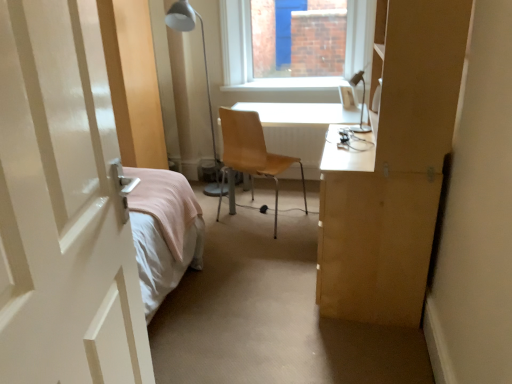
Question: Is there a large distance between metallic silver table lamp at upper right, which is the second table lamp in left-to-right order, and light brown wood chair at center?

Choices:
 (A) no
 (B) yes

Answer: (A)

Question: Is metallic silver table lamp at upper right, which is the second table lamp in left-to-right order, positioned with its back to light brown wood chair at center?

Choices:
 (A) no
 (B) yes

Answer: (A)

Question: Is metallic silver table lamp at upper right, which is the second table lamp in left-to-right order, facing towards light brown wood chair at center?

Choices:
 (A) no
 (B) yes

Answer: (A)

Question: Considering the relative sizes of metallic silver table lamp at upper right, arranged as the first table lamp when viewed from the front, and light brown wood chair at center in the image provided, is metallic silver table lamp at upper right, arranged as the first table lamp when viewed from the front, thinner than light brown wood chair at center?

Choices:
 (A) no
 (B) yes

Answer: (B)

Question: Is metallic silver table lamp at upper right, the 2th table lamp viewed from the back, further to the viewer compared to light brown wood chair at center?

Choices:
 (A) yes
 (B) no

Answer: (B)

Question: Considering the relative sizes of metallic silver table lamp at upper right, the 2th table lamp viewed from the back, and light brown wood chair at center in the image provided, is metallic silver table lamp at upper right, the 2th table lamp viewed from the back, shorter than light brown wood chair at center?

Choices:
 (A) no
 (B) yes

Answer: (B)

Question: From the image's perspective, is white glossy desk at center located beneath metallic silver table lamp at upper right, the 2th table lamp viewed from the back?

Choices:
 (A) no
 (B) yes

Answer: (B)

Question: Is white glossy desk at center facing away from metallic silver table lamp at upper right, arranged as the 1th table lamp when viewed from the right?

Choices:
 (A) yes
 (B) no

Answer: (B)

Question: Can you confirm if white glossy desk at center is shorter than metallic silver table lamp at upper right, arranged as the first table lamp when viewed from the front?

Choices:
 (A) no
 (B) yes

Answer: (A)

Question: From a real-world perspective, is white glossy desk at center on top of metallic silver table lamp at upper right, which is the second table lamp in left-to-right order?

Choices:
 (A) yes
 (B) no

Answer: (B)

Question: Does white glossy desk at center touch metallic silver table lamp at upper right, arranged as the 1th table lamp when viewed from the right?

Choices:
 (A) no
 (B) yes

Answer: (A)

Question: Is the depth of white glossy desk at center greater than that of metallic silver table lamp at upper right, which is the second table lamp in left-to-right order?

Choices:
 (A) no
 (B) yes

Answer: (B)

Question: Is light brown wood chair at center facing away from white glossy door at left?

Choices:
 (A) yes
 (B) no

Answer: (A)